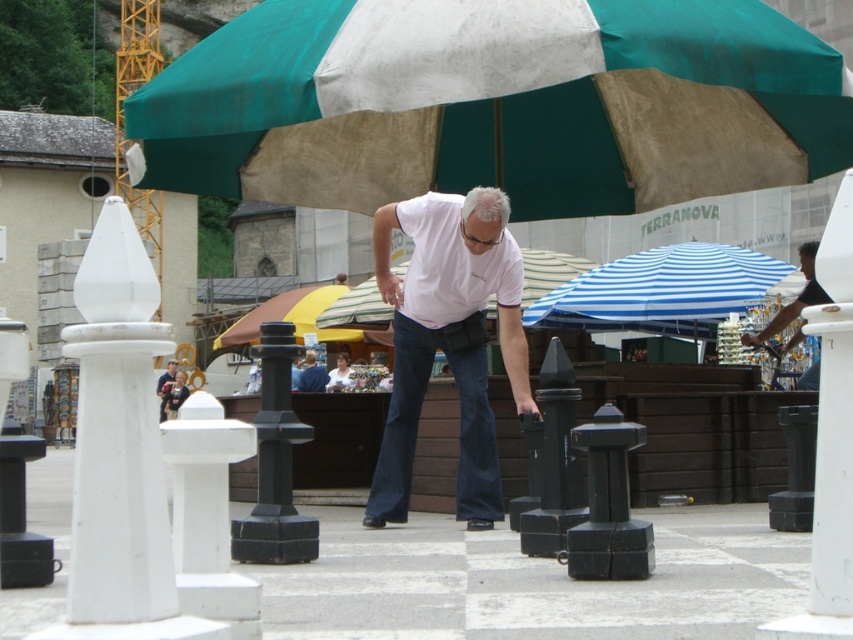
From the picture: You are standing in the market square and see the white matte shirt at center and the white striped umbrella at center. Which object is nearer to you?

The white matte shirt at center is closer to the viewer than the white striped umbrella at center.

You are a photographer trying to capture the chess scene. You want to ensure both the blue striped fabric umbrella at center and the black fabric umbrella at upper right are visible in your shot. Based on their positions, which umbrella is closer to the camera?

The blue striped fabric umbrella at center is closer to the camera because it is located below the black fabric umbrella at upper right, indicating it is positioned in front.